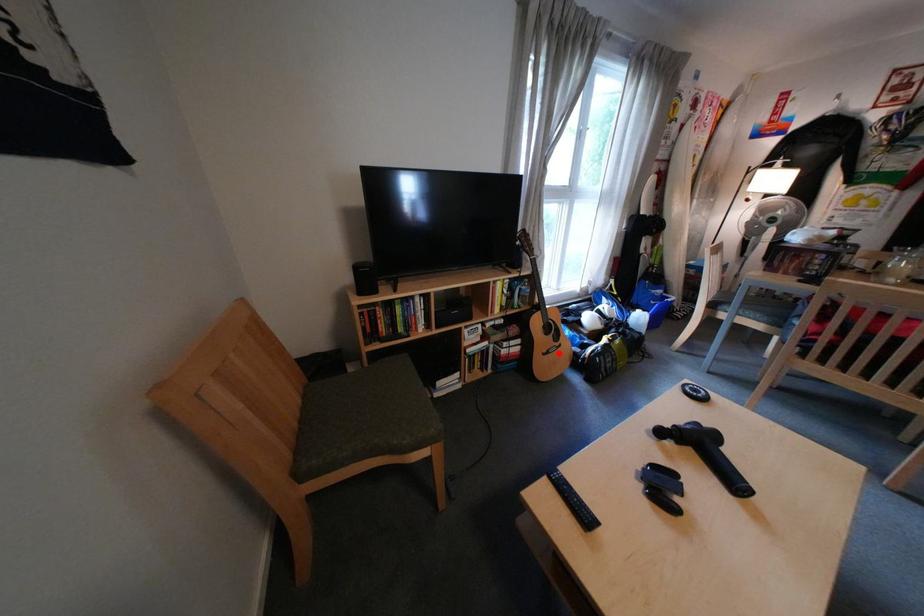
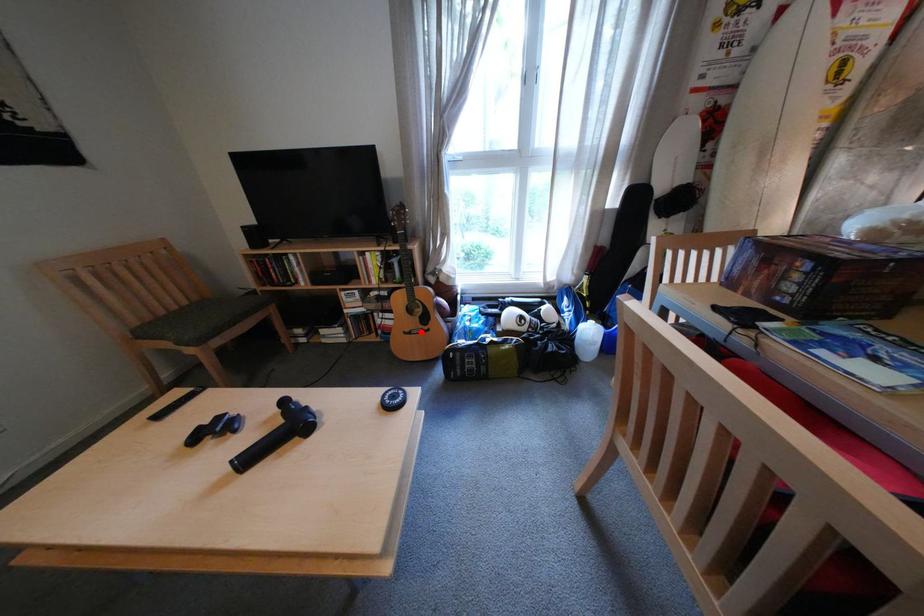
I am providing you with two images of the same scene from different viewpoints. A red point is marked on the first image and another point is marked on the second image. Does the point marked in image1 correspond to the same location as the one in image2?

Yes